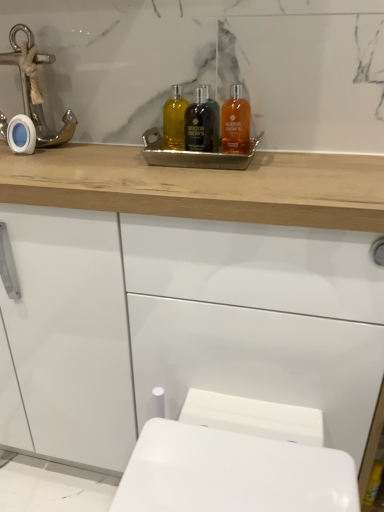
Identify the location of unoccupied area in front of black glass bottle at center, the 2th mouthwash from the right. (213, 174).